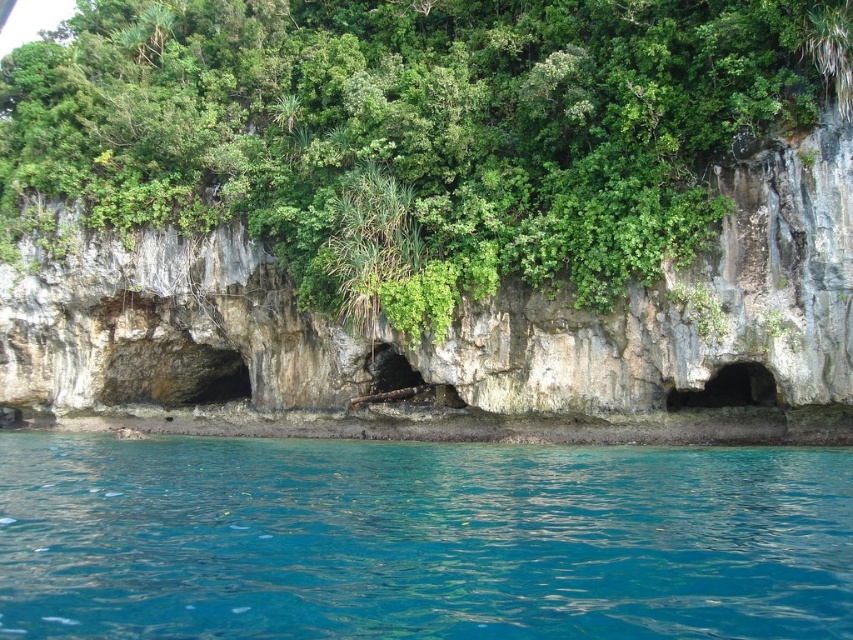
You are standing at the base of the cliff and want to take a photo of the point at coordinates point [679,193]. If your camera has a maximum focus range of 30 meters, will you be able to focus on that point?

The distance of point [679,193] from camera is 33.74 meters, which exceeds the camera maximum focus range of 30 meters. Therefore, the camera cannot focus on that point.

You are a bird looking for a nesting spot. You see the green leafy tree at center and the clear blue water at lower center. Which location would be a better spot for building a nest?

The green leafy tree at center is a better nesting spot because it is positioned over the clear blue water at lower center, providing a safe elevated position with proximity to water resources.